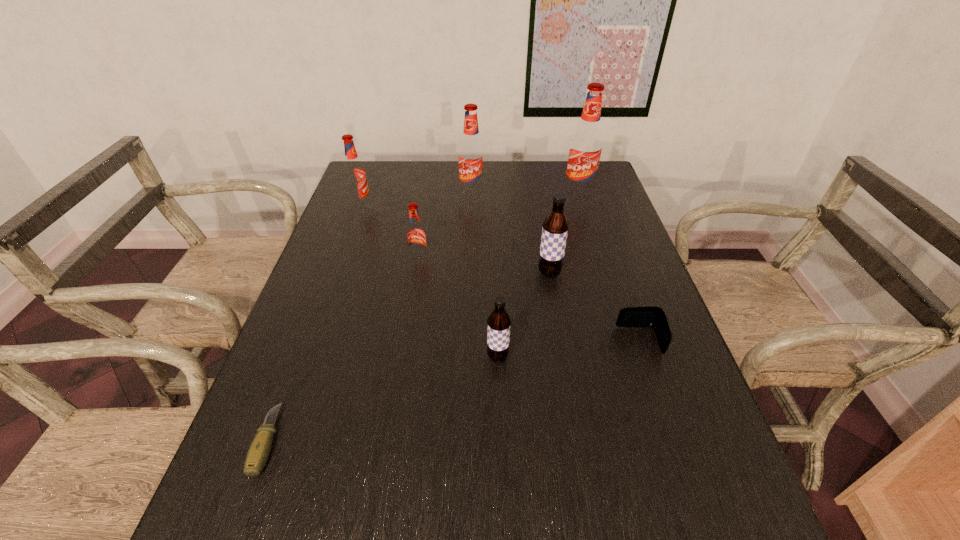
At what (x,y) coordinates should I click in order to perform the action: click on free space located 0.120m on the left of the fourth root beer from left to right. Please return your answer as a coordinate pair (x, y). This screenshot has height=540, width=960. Looking at the image, I should click on (x=432, y=357).

At what (x,y) coordinates should I click in order to perform the action: click on blank space located on the outer surface of the wallet. Please return your answer as a coordinate pair (x, y). This screenshot has height=540, width=960. Looking at the image, I should click on (510, 341).

This screenshot has width=960, height=540. I want to click on blank area located on the outer surface of the wallet, so click(x=501, y=341).

At what (x,y) coordinates should I click in order to perform the action: click on free space located on the outer surface of the wallet. Please return your answer as a coordinate pair (x, y). The width and height of the screenshot is (960, 540). Looking at the image, I should click on (571, 341).

Identify the location of vacant region located on the right of the shortest object. The image size is (960, 540). (367, 440).

You are a GUI agent. You are given a task and a screenshot of the screen. Output one action in this format:
    pyautogui.click(x=<x>, y=<y>)
    Task: Click on the root beer that is at the left edge
    This screenshot has width=960, height=540.
    Given the screenshot: What is the action you would take?
    pyautogui.click(x=355, y=177)

The width and height of the screenshot is (960, 540). Identify the location of pocketknife that is at the left edge. (259, 450).

This screenshot has height=540, width=960. Identify the location of root beer that is positioned at the right edge. (586, 144).

Find the location of a particular element. This screenshot has height=540, width=960. wallet at the right edge is located at coordinates (650, 316).

Find the location of `object at the far right corner`. object at the far right corner is located at coordinates (586, 144).